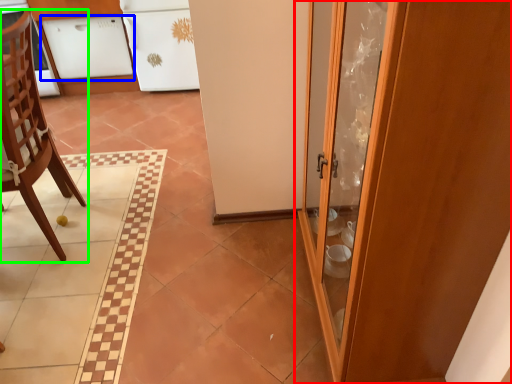
Question: Which object is the farthest from door (highlighted by a red box)? Choose among these: cabinetry (highlighted by a blue box) or chair (highlighted by a green box).

Choices:
 (A) cabinetry
 (B) chair

Answer: (A)